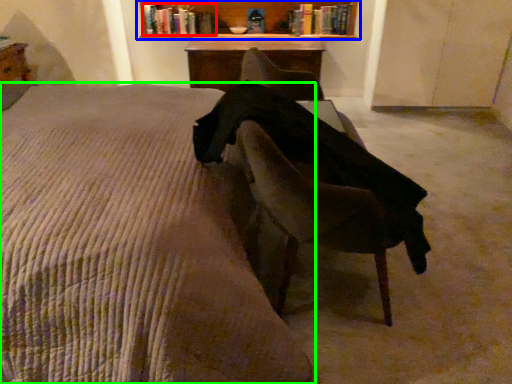
Question: Based on their relative distances, which object is nearer to book (highlighted by a red box)? Choose from shelf (highlighted by a blue box) and bed (highlighted by a green box).

Choices:
 (A) shelf
 (B) bed

Answer: (A)